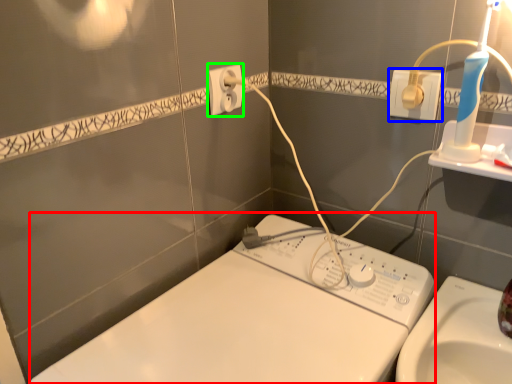
Question: Estimate the real-world distances between objects in this image. Which object is farther from machine (highlighted by a red box), power plugs and sockets (highlighted by a blue box) or power plugs and sockets (highlighted by a green box)?

Choices:
 (A) power plugs and sockets
 (B) power plugs and sockets

Answer: (A)